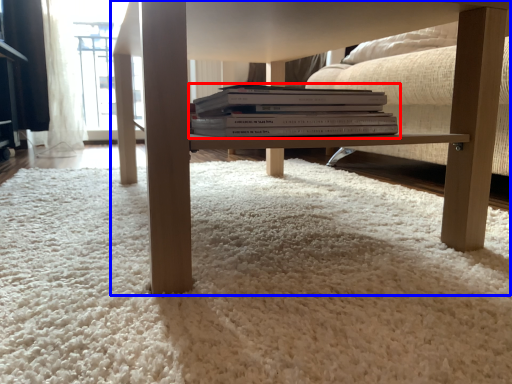
Question: Which of the following is the farthest to the observer, book (highlighted by a red box) or table (highlighted by a blue box)?

Choices:
 (A) book
 (B) table

Answer: (A)